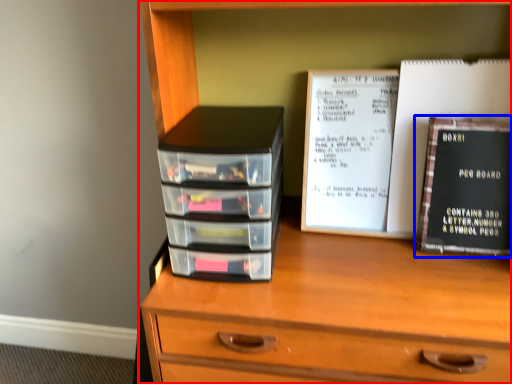
Question: Which object appears farthest to the camera in this image, chest of drawers (highlighted by a red box) or book (highlighted by a blue box)?

Choices:
 (A) chest of drawers
 (B) book

Answer: (B)